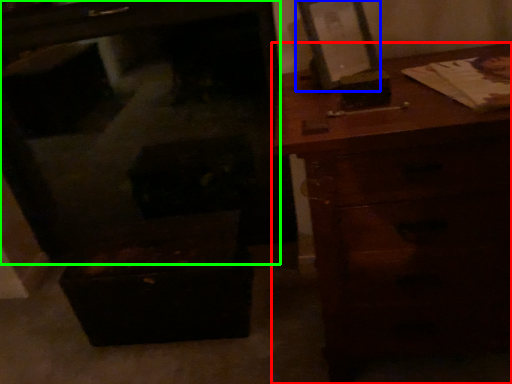
Question: Based on their relative distances, which object is farther from chest of drawers (highlighted by a red box)? Choose from picture frame (highlighted by a blue box) and furniture (highlighted by a green box).

Choices:
 (A) picture frame
 (B) furniture

Answer: (B)